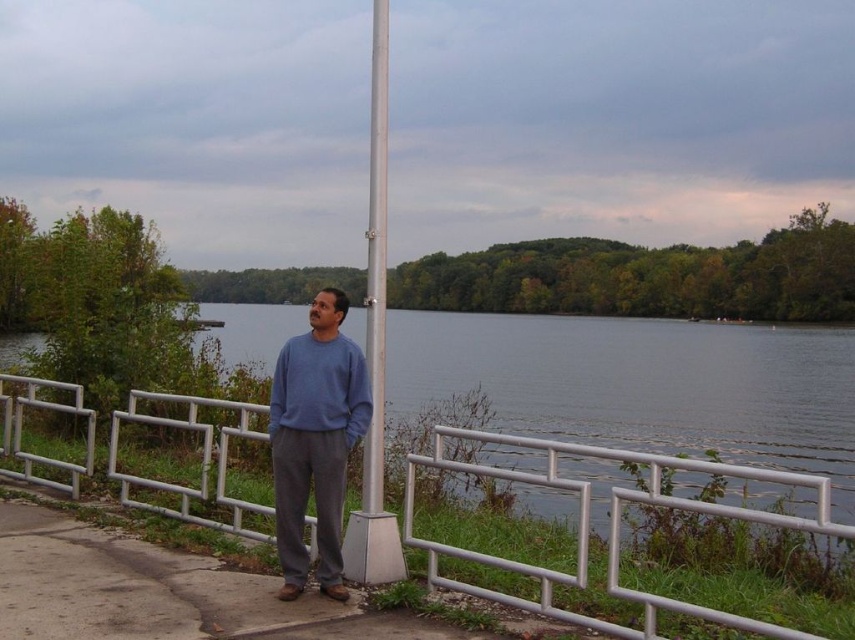
Does silver metallic fence at center appear on the right side of matte blue sweater at center?

Incorrect, silver metallic fence at center is not on the right side of matte blue sweater at center.

Can you confirm if silver metallic fence at center is positioned to the left of matte blue sweater at center?

Correct, you'll find silver metallic fence at center to the left of matte blue sweater at center.

Does point (190, 408) lie in front of point (304, 506)?

That is False.

Locate an element on the screen. This screenshot has width=855, height=640. silver metallic fence at center is located at coordinates (610, 529).

Does matte blue sweater at center appear on the left side of silver metallic pole at center?

No, matte blue sweater at center is not to the left of silver metallic pole at center.

In the scene shown: How much distance is there between matte blue sweater at center and silver metallic pole at center?

The distance of matte blue sweater at center from silver metallic pole at center is 7.41 feet.

Is point (290, 454) positioned in front of point (355, 541)?

Yes, it is.

Locate an element on the screen. The height and width of the screenshot is (640, 855). matte blue sweater at center is located at coordinates (315, 440).

Is silver metallic fence at center below silver metallic pole at center?

Indeed, silver metallic fence at center is positioned under silver metallic pole at center.

From the picture: Is silver metallic fence at center taller than silver metallic pole at center?

No.

Which is behind, point (506, 596) or point (384, 285)?

The point (384, 285) is more distant.

Find the location of a particular element. silver metallic fence at center is located at coordinates (610, 529).